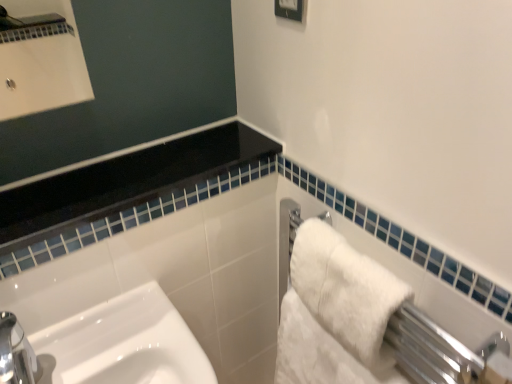
Question: Is the depth of white fluffy bath towel at right, the second bath towel in the top-to-bottom sequence, less than that of white glossy frame at upper center?

Choices:
 (A) yes
 (B) no

Answer: (B)

Question: Considering the relative sizes of white fluffy bath towel at right, arranged as the 1th bath towel when ordered from the bottom, and white glossy frame at upper center in the image provided, is white fluffy bath towel at right, arranged as the 1th bath towel when ordered from the bottom, wider than white glossy frame at upper center?

Choices:
 (A) no
 (B) yes

Answer: (B)

Question: Can you confirm if white fluffy bath towel at right, the second bath towel in the top-to-bottom sequence, is smaller than white glossy frame at upper center?

Choices:
 (A) yes
 (B) no

Answer: (B)

Question: Is white fluffy bath towel at right, the second bath towel in the top-to-bottom sequence, far away from white glossy frame at upper center?

Choices:
 (A) yes
 (B) no

Answer: (B)

Question: Does white fluffy bath towel at right, the second bath towel in the top-to-bottom sequence, have a greater height compared to white glossy frame at upper center?

Choices:
 (A) yes
 (B) no

Answer: (A)

Question: Is white fluffy bath towel at right, arranged as the 1th bath towel when ordered from the bottom, wider or thinner than white fluffy bath towel at right, which is counted as the 2th bath towel, starting from the bottom?

Choices:
 (A) thin
 (B) wide

Answer: (B)

Question: Which is correct: white fluffy bath towel at right, the second bath towel in the top-to-bottom sequence, is inside white fluffy bath towel at right, which is counted as the 2th bath towel, starting from the bottom, or outside of it?

Choices:
 (A) inside
 (B) outside

Answer: (B)

Question: Based on their sizes in the image, would you say white fluffy bath towel at right, the second bath towel in the top-to-bottom sequence, is bigger or smaller than white fluffy bath towel at right, the first bath towel in the top-to-bottom sequence?

Choices:
 (A) big
 (B) small

Answer: (A)

Question: From their relative heights in the image, would you say white fluffy bath towel at right, the second bath towel in the top-to-bottom sequence, is taller or shorter than white fluffy bath towel at right, which is counted as the 2th bath towel, starting from the bottom?

Choices:
 (A) short
 (B) tall

Answer: (B)

Question: Is white fluffy bath towel at right, which is counted as the 2th bath towel, starting from the bottom, situated inside white fluffy bath towel at right, the second bath towel in the top-to-bottom sequence, or outside?

Choices:
 (A) outside
 (B) inside

Answer: (A)

Question: Considering the relative positions of white fluffy bath towel at right, the first bath towel in the top-to-bottom sequence, and white fluffy bath towel at right, arranged as the 1th bath towel when ordered from the bottom, in the image provided, is white fluffy bath towel at right, the first bath towel in the top-to-bottom sequence, to the left or to the right of white fluffy bath towel at right, arranged as the 1th bath towel when ordered from the bottom,?

Choices:
 (A) left
 (B) right

Answer: (B)

Question: Is white fluffy bath towel at right, the first bath towel in the top-to-bottom sequence, taller or shorter than white fluffy bath towel at right, arranged as the 1th bath towel when ordered from the bottom?

Choices:
 (A) short
 (B) tall

Answer: (A)

Question: Relative to white fluffy bath towel at right, arranged as the 1th bath towel when ordered from the bottom, is white fluffy bath towel at right, the first bath towel in the top-to-bottom sequence, in front or behind?

Choices:
 (A) behind
 (B) front

Answer: (B)

Question: Considering the positions of white glossy frame at upper center and white fluffy bath towel at right, which is counted as the 2th bath towel, starting from the bottom, in the image, is white glossy frame at upper center taller or shorter than white fluffy bath towel at right, which is counted as the 2th bath towel, starting from the bottom,?

Choices:
 (A) tall
 (B) short

Answer: (B)

Question: From the image's perspective, relative to white fluffy bath towel at right, the first bath towel in the top-to-bottom sequence, is white glossy frame at upper center above or below?

Choices:
 (A) below
 (B) above

Answer: (B)